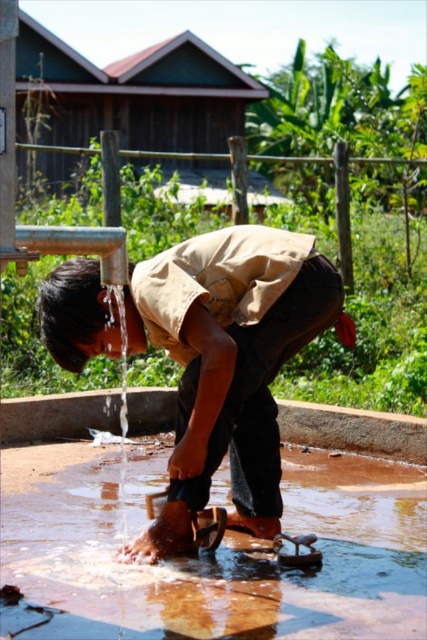
Question: Is clear liquid water at lower center to the left of brown leather sandal at lower center from the viewer's perspective?

Choices:
 (A) no
 (B) yes

Answer: (B)

Question: Is clear liquid water at lower center smaller than brown leather sandal at lower center?

Choices:
 (A) no
 (B) yes

Answer: (A)

Question: Can you confirm if clear liquid water at lower center is smaller than brown leather sandal at lower center?

Choices:
 (A) yes
 (B) no

Answer: (B)